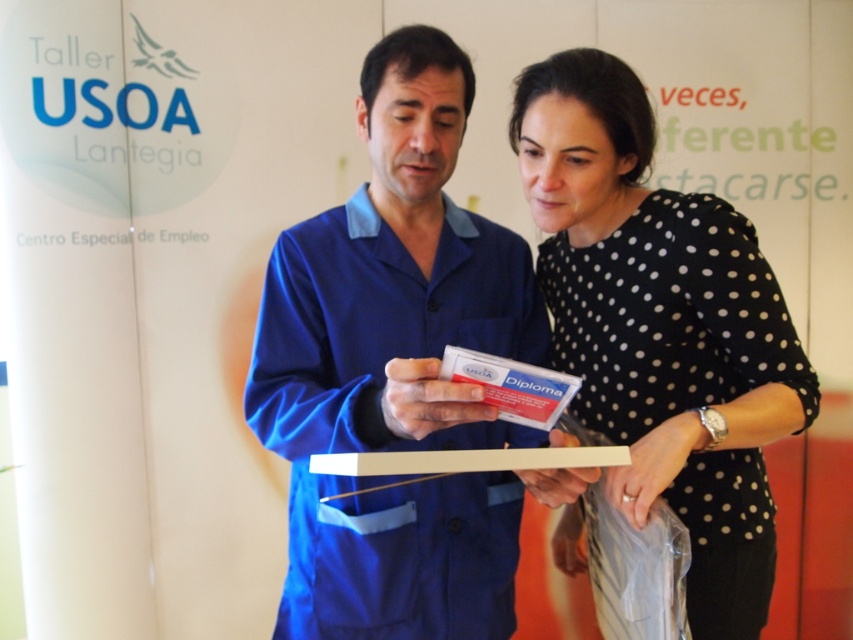
Question: Can you confirm if blue fabric shirt at center is wider than black dotted shirt at center?

Choices:
 (A) yes
 (B) no

Answer: (A)

Question: Which object is farther from the camera taking this photo?

Choices:
 (A) black dotted shirt at center
 (B) blue fabric shirt at center

Answer: (A)

Question: Is blue fabric shirt at center thinner than black dotted shirt at center?

Choices:
 (A) yes
 (B) no

Answer: (B)

Question: Which of the following is the closest to the observer?

Choices:
 (A) black dotted shirt at center
 (B) blue fabric shirt at center

Answer: (B)

Question: Is blue fabric shirt at center smaller than black dotted shirt at center?

Choices:
 (A) yes
 (B) no

Answer: (A)